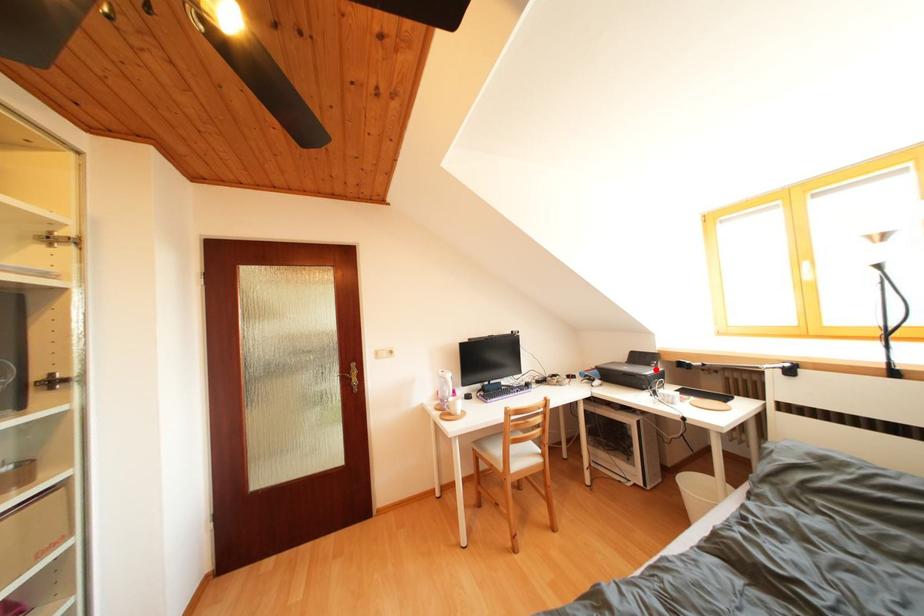
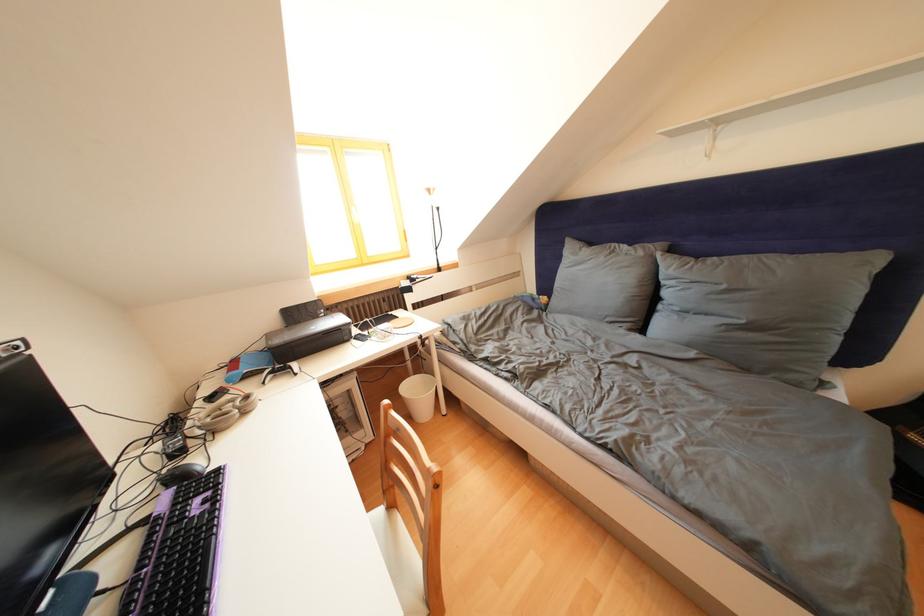
Question: I am providing you with two images of the same scene from different viewpoints. Given a red point in image1, look at the same physical point in image2. Is it:

Choices:
 (A) Closer to the viewpoint
 (B) Farther from the viewpoint

Answer: (A)